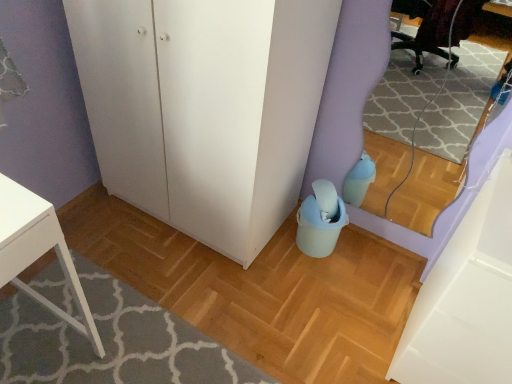
Question: Is matte plastic bucket at lower center looking in the opposite direction of white matte cabinet at lower right?

Choices:
 (A) no
 (B) yes

Answer: (A)

Question: Does matte plastic bucket at lower center touch white matte cabinet at lower right?

Choices:
 (A) yes
 (B) no

Answer: (B)

Question: Does matte plastic bucket at lower center have a larger size compared to white matte cabinet at lower right?

Choices:
 (A) no
 (B) yes

Answer: (A)

Question: Is matte plastic bucket at lower center oriented towards white matte cabinet at lower right?

Choices:
 (A) yes
 (B) no

Answer: (B)

Question: Is matte plastic bucket at lower center positioned far away from white matte cabinet at lower right?

Choices:
 (A) no
 (B) yes

Answer: (A)

Question: Considering the positions of white matte cabinet at lower right and white matte cabinet at lower right in the image, is white matte cabinet at lower right taller or shorter than white matte cabinet at lower right?

Choices:
 (A) short
 (B) tall

Answer: (A)

Question: Considering the positions of point (437, 359) and point (152, 46), is point (437, 359) closer or farther from the camera than point (152, 46)?

Choices:
 (A) closer
 (B) farther

Answer: (A)

Question: Would you say white matte cabinet at lower right is inside or outside white matte cabinet at lower right?

Choices:
 (A) outside
 (B) inside

Answer: (A)

Question: Considering the positions of white matte cabinet at lower right and white matte cabinet at lower right in the image, is white matte cabinet at lower right wider or thinner than white matte cabinet at lower right?

Choices:
 (A) wide
 (B) thin

Answer: (B)

Question: From the image's perspective, is white matte cabinet at lower right above or below matte plastic bucket at lower center?

Choices:
 (A) below
 (B) above

Answer: (B)

Question: Considering the positions of white matte cabinet at lower right and matte plastic bucket at lower center in the image, is white matte cabinet at lower right taller or shorter than matte plastic bucket at lower center?

Choices:
 (A) short
 (B) tall

Answer: (B)

Question: In the image, is white matte cabinet at lower right on the left side or the right side of matte plastic bucket at lower center?

Choices:
 (A) right
 (B) left

Answer: (A)

Question: Does point (228, 34) appear closer or farther from the camera than point (124, 352)?

Choices:
 (A) closer
 (B) farther

Answer: (A)

Question: Is white matte cabinet at lower right to the left or to the right of white matte cabinet at lower right in the image?

Choices:
 (A) left
 (B) right

Answer: (A)

Question: Is white matte cabinet at lower right spatially inside white matte cabinet at lower right, or outside of it?

Choices:
 (A) outside
 (B) inside

Answer: (A)